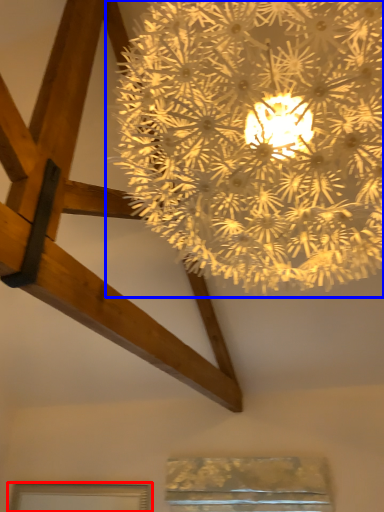
Question: Among these objects, which one is nearest to the camera, window (highlighted by a red box) or lamp (highlighted by a blue box)?

Choices:
 (A) window
 (B) lamp

Answer: (B)